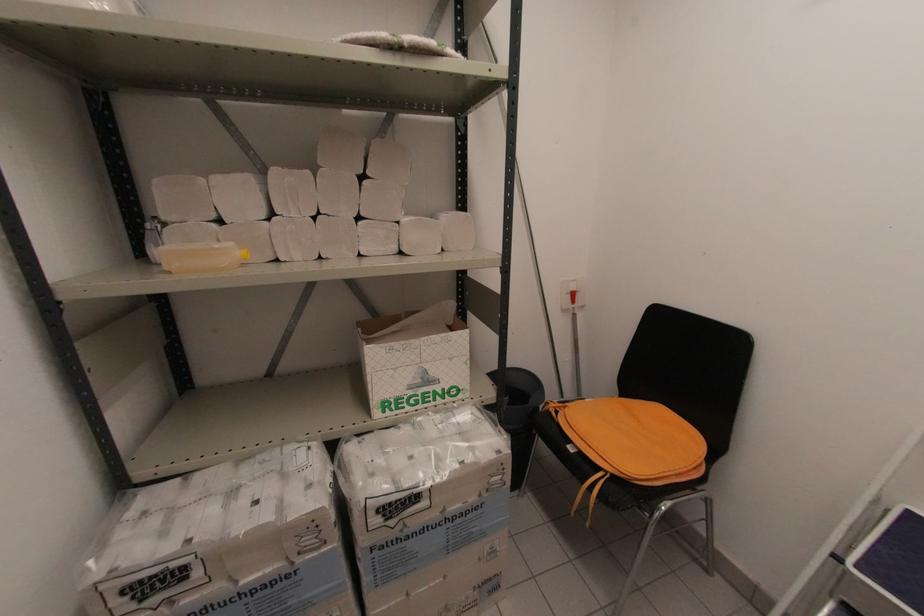
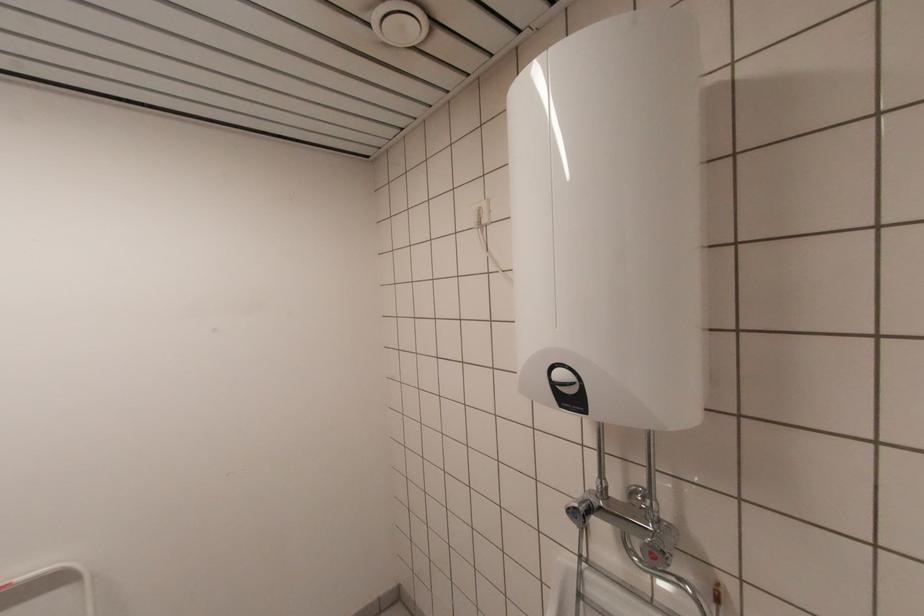
Question: The first image is from the beginning of the video and the second image is from the end. How did the camera likely rotate when shooting the video?

Choices:
 (A) Left
 (B) Right
 (C) Up
 (D) Down

Answer: (B)